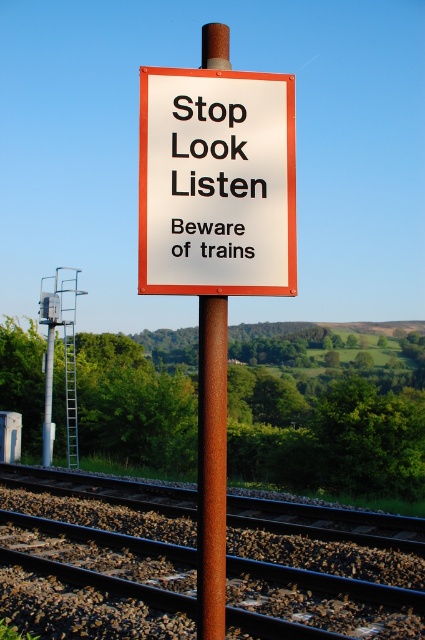
What do you see at coordinates (212, 467) in the screenshot? I see `rusty metal pole at center` at bounding box center [212, 467].

Who is higher up, rusty metal pole at center or black plastic sign at center?

black plastic sign at center is above.

This screenshot has height=640, width=425. What do you see at coordinates (212, 467) in the screenshot?
I see `rusty metal pole at center` at bounding box center [212, 467].

Locate an element on the screen. Image resolution: width=425 pixels, height=640 pixels. rusty metal pole at center is located at coordinates (212, 467).

Is the position of white plastic sign at center less distant than that of rusty metal tracks at lower center?

Yes, white plastic sign at center is closer to the viewer.

Is point (184, 132) more distant than point (351, 627)?

No, it is in front of (351, 627).

The height and width of the screenshot is (640, 425). Describe the element at coordinates (217, 182) in the screenshot. I see `white plastic sign at center` at that location.

Identify the location of white plastic sign at center. (217, 182).

Does white plastic sign at center appear under rusty metal pole at center?

Incorrect, white plastic sign at center is not positioned below rusty metal pole at center.

Who is positioned more to the right, white plastic sign at center or rusty metal pole at center?

white plastic sign at center

At what (x,y) coordinates should I click in order to perform the action: click on white plastic sign at center. Please return your answer as a coordinate pair (x, y). Looking at the image, I should click on (217, 182).